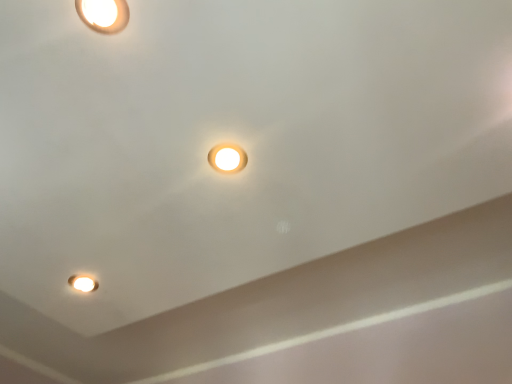
Question: Does matte white light fixture at lower left lie behind matte white lamp at center, the second lamp positioned from the front?

Choices:
 (A) no
 (B) yes

Answer: (B)

Question: Is matte white light fixture at lower left at the left side of matte white lamp at center, which is the 2th lamp in top-to-bottom order?

Choices:
 (A) yes
 (B) no

Answer: (A)

Question: From the image's perspective, does matte white light fixture at lower left appear higher than matte white lamp at center, which is the 2th lamp in top-to-bottom order?

Choices:
 (A) no
 (B) yes

Answer: (A)

Question: Is matte white light fixture at lower left wider than matte white lamp at center, which is the 2th lamp in top-to-bottom order?

Choices:
 (A) no
 (B) yes

Answer: (A)

Question: Is matte white light fixture at lower left not within matte white lamp at center, acting as the second lamp starting from the left?

Choices:
 (A) no
 (B) yes

Answer: (B)

Question: Considering the positions of matte white lamp at center, which is the 2th lamp in top-to-bottom order, and matte white light fixture at lower left in the image, is matte white lamp at center, which is the 2th lamp in top-to-bottom order, taller or shorter than matte white light fixture at lower left?

Choices:
 (A) short
 (B) tall

Answer: (A)

Question: Considering the positions of point (217, 152) and point (90, 289), is point (217, 152) closer or farther from the camera than point (90, 289)?

Choices:
 (A) farther
 (B) closer

Answer: (B)

Question: From the image's perspective, is matte white lamp at center, acting as the second lamp starting from the left, above or below matte white light fixture at lower left?

Choices:
 (A) above
 (B) below

Answer: (A)

Question: Relative to matte white light fixture at lower left, is matte white lamp at center, arranged as the 1th lamp when viewed from the right, in front or behind?

Choices:
 (A) front
 (B) behind

Answer: (A)

Question: In terms of height, does matte white lamp at center, which is the 2th lamp in top-to-bottom order, look taller or shorter compared to matte white lamp at upper left, the first lamp from the top?

Choices:
 (A) short
 (B) tall

Answer: (A)

Question: From the image's perspective, relative to matte white lamp at upper left, acting as the 2th lamp starting from the right, is matte white lamp at center, acting as the second lamp starting from the left, above or below?

Choices:
 (A) below
 (B) above

Answer: (A)

Question: Looking at their shapes, would you say matte white lamp at center, the second lamp positioned from the front, is wider or thinner than matte white lamp at upper left, acting as the 2th lamp starting from the right?

Choices:
 (A) thin
 (B) wide

Answer: (A)

Question: Based on their positions, is matte white lamp at center, arranged as the 1th lamp when viewed from the right, located to the left or right of matte white lamp at upper left, placed as the first lamp when sorted from front to back?

Choices:
 (A) left
 (B) right

Answer: (B)

Question: Looking at their shapes, would you say matte white light fixture at lower left is wider or thinner than matte white lamp at upper left, which is counted as the 2th lamp, starting from the back?

Choices:
 (A) wide
 (B) thin

Answer: (B)

Question: Considering the positions of matte white light fixture at lower left and matte white lamp at upper left, which appears as the second lamp when ordered from the bottom, in the image, is matte white light fixture at lower left taller or shorter than matte white lamp at upper left, which appears as the second lamp when ordered from the bottom,?

Choices:
 (A) tall
 (B) short

Answer: (A)